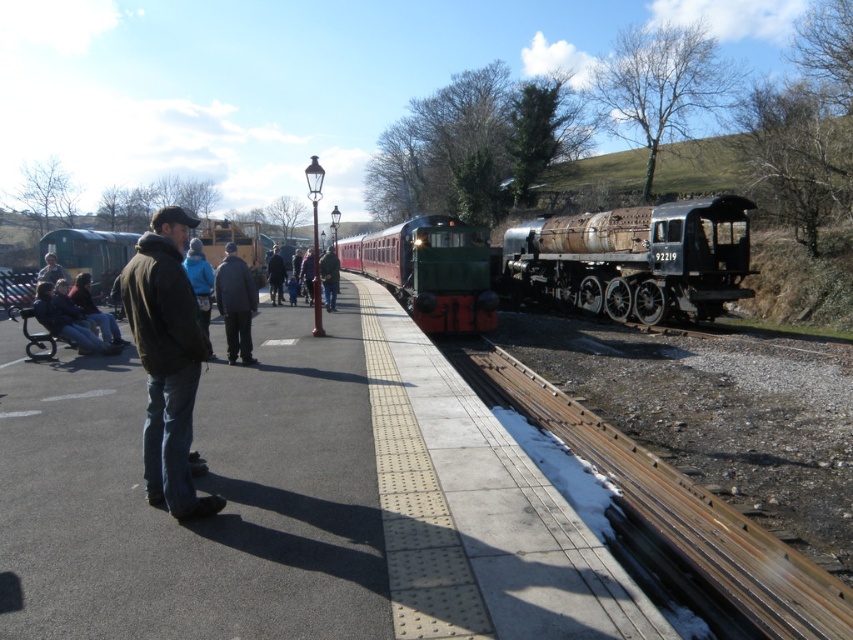
Question: Is rusty metal train at right thinner than green polished wood train at center?

Choices:
 (A) yes
 (B) no

Answer: (A)

Question: Which object is positioned closest to the dark brown leather jacket at center?

Choices:
 (A) dark brown leather jacket at left
 (B) green matte train at left
 (C) blue fleece jacket at center

Answer: (C)

Question: Is dark brown leather jacket at center bigger than blue fleece jacket at center?

Choices:
 (A) no
 (B) yes

Answer: (A)

Question: Which of the following is the farthest from the observer?

Choices:
 (A) dark brown leather jacket at center
 (B) green matte train at left

Answer: (B)

Question: Is green matte train at left thinner than blue fleece jacket at center?

Choices:
 (A) no
 (B) yes

Answer: (A)

Question: Among these objects, which one is nearest to the camera?

Choices:
 (A) green polished wood train at center
 (B) dark brown leather jacket at center

Answer: (B)